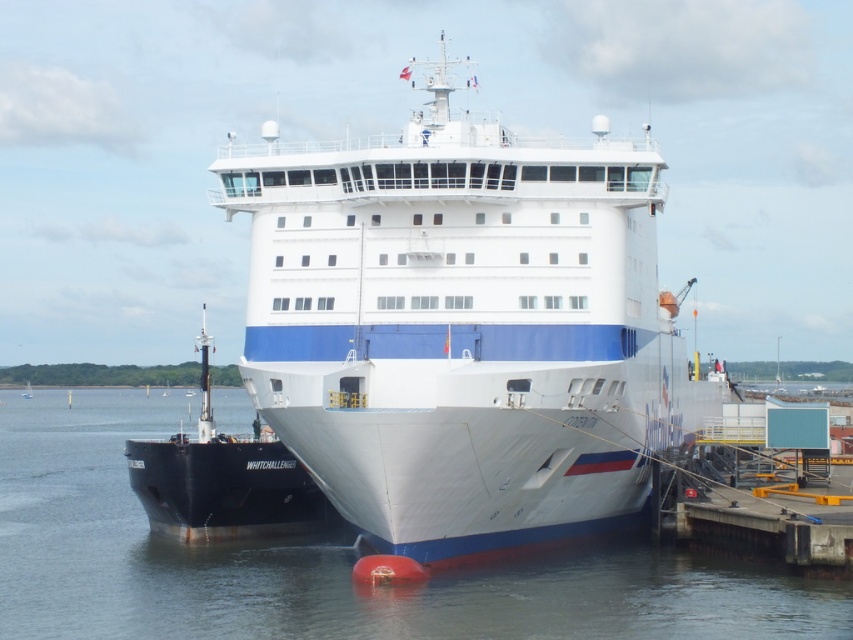
You are standing on the pier and want to board the ferry. Which object, the white glossy water at center or the black matte ship at left, is closer to you as you face the ferry?

A: The white glossy water at center is closer to you because it is in front of the black matte ship at left.

You are a photographer trying to capture the ferry and the tugboat in a single shot. Given that the white glossy water at center takes up less space than the black matte ship at left in the image, which object should you focus on to ensure both are visible in the frame?

Since the white glossy water at center occupies less space than the black matte ship at left, you should focus on the black matte ship at left to ensure both objects are visible in the frame, as it takes up more space and can help balance the composition while including the smaller water area.

You are standing on the pier and looking at the ferry. Which object is positioned to the left of the other between the white glossy water at center and the black matte ship at left?

The white glossy water at center is to the left of the black matte ship at left.